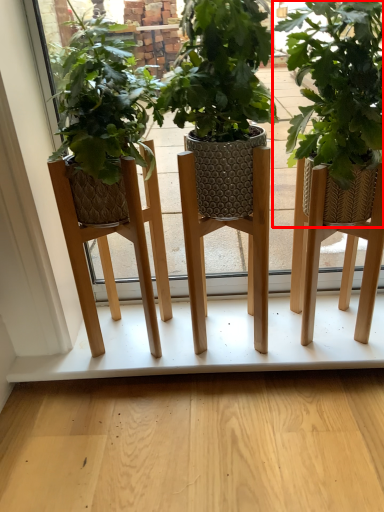
Question: From the image's perspective, considering the relative positions of houseplant (annotated by the red box) and shelf in the image provided, where is houseplant (annotated by the red box) located with respect to the staircase?

Choices:
 (A) above
 (B) below

Answer: (A)